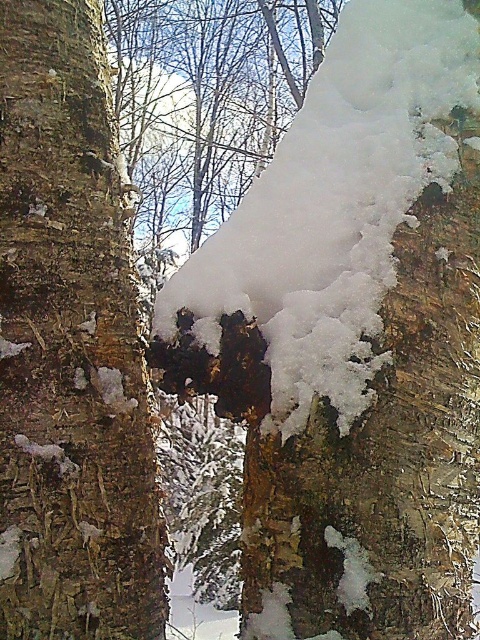
Question: Which object is closer to the camera taking this photo?

Choices:
 (A) white fluffy snow at center
 (B) brown textured bark at center

Answer: (B)

Question: Among these objects, which one is nearest to the camera?

Choices:
 (A) white fluffy snow at center
 (B) brown textured bark at center

Answer: (B)

Question: Is brown textured bark at center below white fluffy snow at center?

Choices:
 (A) no
 (B) yes

Answer: (B)

Question: Which point is farther to the camera?

Choices:
 (A) pos(112,497)
 (B) pos(384,145)

Answer: (B)

Question: Does brown textured bark at center have a larger size compared to white fluffy snow at center?

Choices:
 (A) no
 (B) yes

Answer: (A)

Question: Is brown textured bark at center thinner than white fluffy snow at center?

Choices:
 (A) no
 (B) yes

Answer: (B)